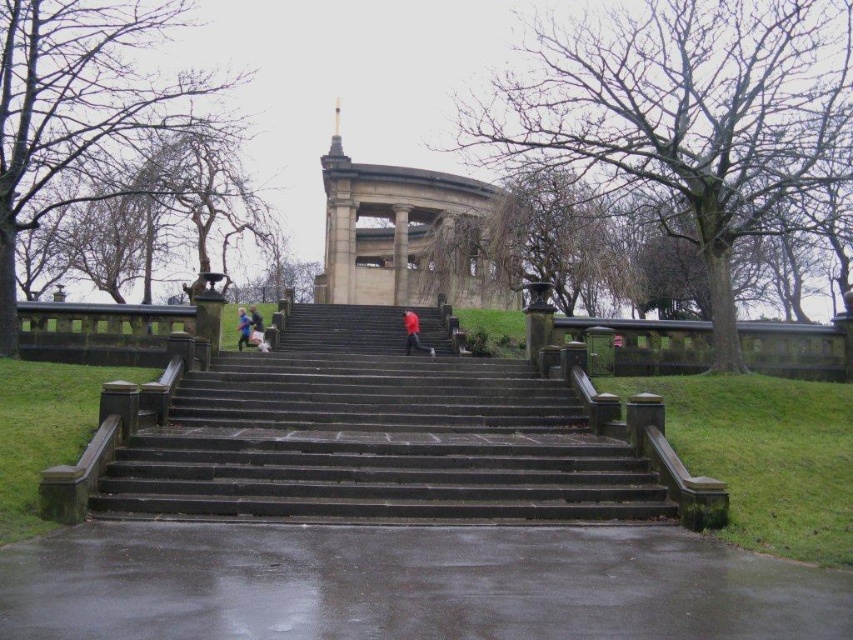
Is point (389, 476) less distant than point (413, 342)?

That is True.

Does dark stone stairs at center have a smaller size compared to red matte jacket at center?

No, dark stone stairs at center is not smaller than red matte jacket at center.

Does point (428, 337) come farther from viewer compared to point (410, 346)?

Yes, it is behind point (410, 346).

Find the location of a particular element. The height and width of the screenshot is (640, 853). dark stone stairs at center is located at coordinates (375, 436).

Which is in front, point (405, 312) or point (244, 324)?

Point (244, 324) is in front.

Does red matte jacket at center have a larger size compared to red jacket at center?

Correct, red matte jacket at center is larger in size than red jacket at center.

Is point (422, 348) in front of point (241, 316)?

That is True.

At what (x,y) coordinates should I click in order to perform the action: click on red matte jacket at center. Please return your answer as a coordinate pair (x, y). Image resolution: width=853 pixels, height=640 pixels. Looking at the image, I should click on (413, 333).

Is stone gazebo at center taller than red jacket at center?

Indeed, stone gazebo at center has a greater height compared to red jacket at center.

Can you confirm if stone gazebo at center is positioned above red jacket at center?

Correct, stone gazebo at center is located above red jacket at center.

Who is more forward, (370, 212) or (248, 320)?

Point (248, 320)

Image resolution: width=853 pixels, height=640 pixels. In order to click on stone gazebo at center in this screenshot , I will do `click(405, 236)`.